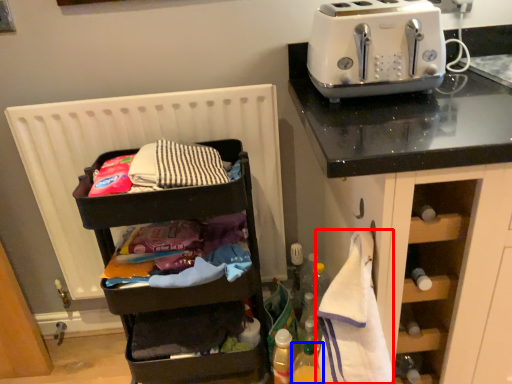
Question: Which object is further to the camera taking this photo, clothe (highlighted by a red box) or bottle (highlighted by a blue box)?

Choices:
 (A) clothe
 (B) bottle

Answer: (B)